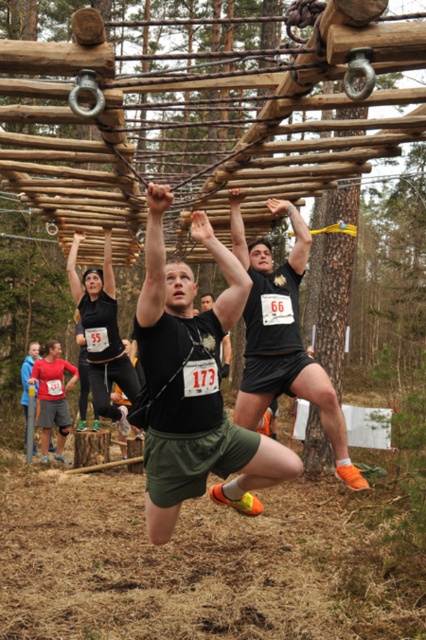
Which is below, black matte shirt at center or matte black shorts at center?

black matte shirt at center is below.

Where is `black matte shirt at center`? Image resolution: width=426 pixels, height=640 pixels. black matte shirt at center is located at coordinates (193, 385).

Does point (207, 433) come farther from viewer compared to point (279, 298)?

No, it is in front of (279, 298).

I want to click on black matte shirt at center, so click(x=193, y=385).